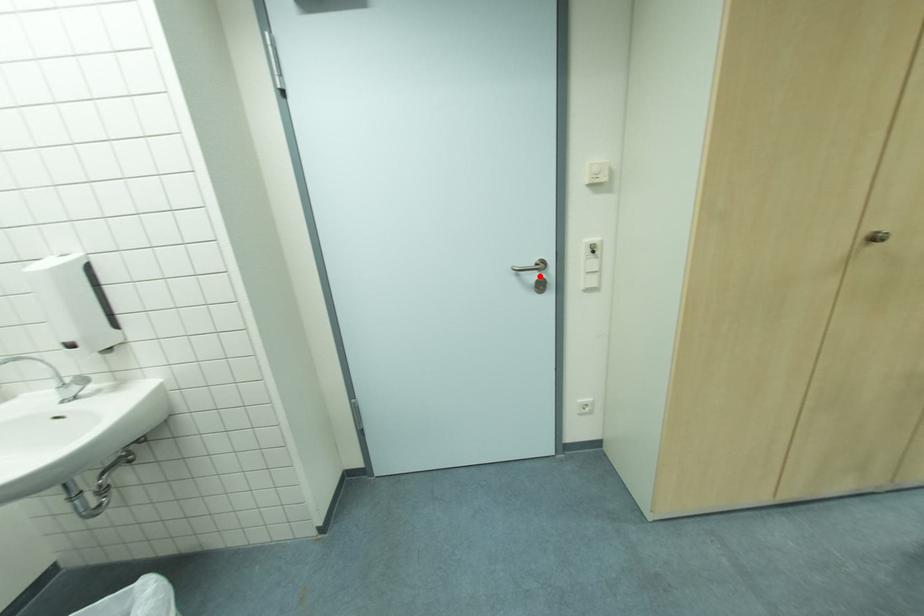
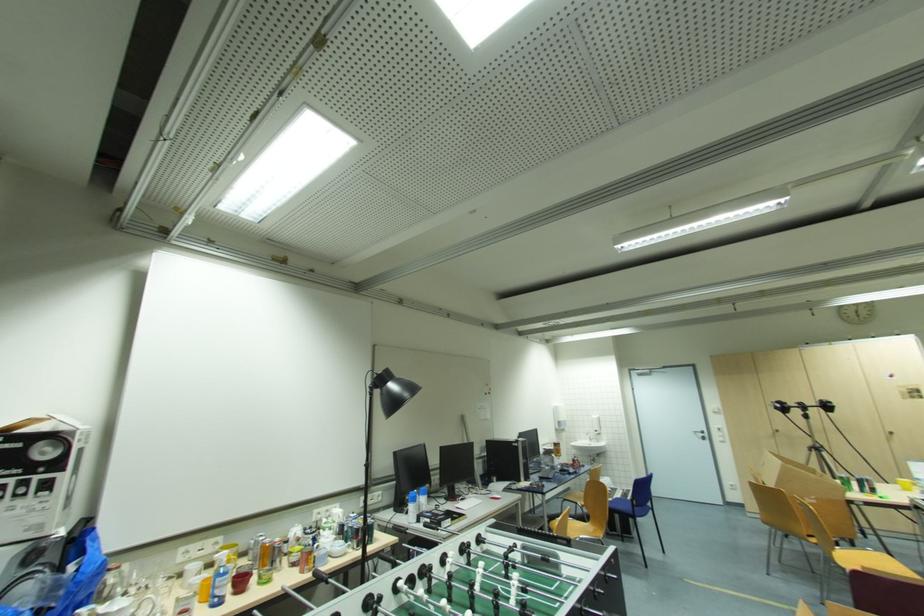
Question: I am providing you with two images of the same scene from different viewpoints. A red point is marked on the first image. At the location where the point appears in image 1, is it still visible in image 2?

Choices:
 (A) Yes
 (B) No

Answer: (A)